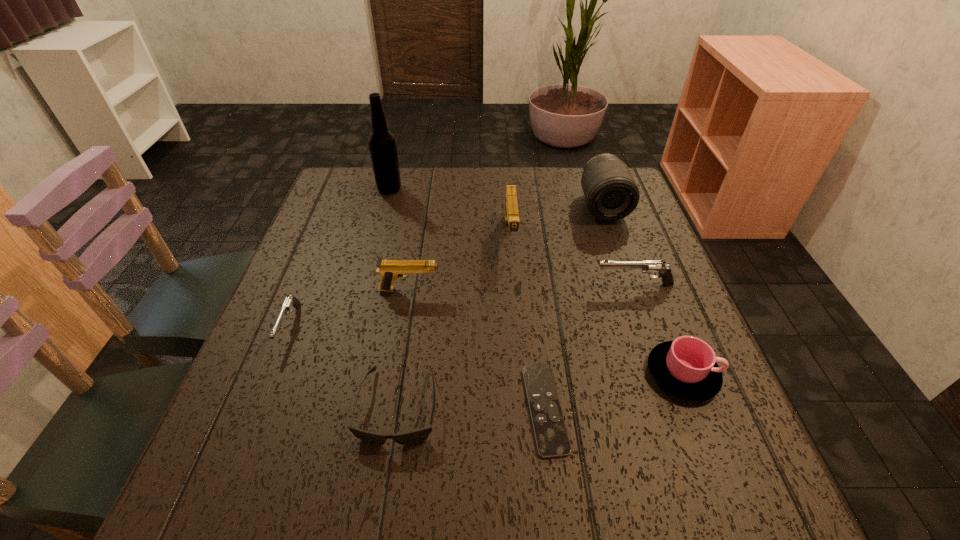
Where is `cup present at the right edge`? cup present at the right edge is located at coordinates (686, 367).

Where is `object present at the far left corner`? object present at the far left corner is located at coordinates (382, 145).

Find the location of `object present at the far right corner`. object present at the far right corner is located at coordinates (611, 193).

Locate an element on the screen. This screenshot has height=540, width=960. blank space at the far edge of the desktop is located at coordinates (388, 207).

Locate an element on the screen. This screenshot has height=540, width=960. vacant space at the near edge of the desktop is located at coordinates (460, 491).

At what (x,y) coordinates should I click in order to perform the action: click on free location at the left edge of the desktop. Please return your answer as a coordinate pair (x, y). The height and width of the screenshot is (540, 960). Looking at the image, I should click on (315, 291).

Find the location of a particular element. The width and height of the screenshot is (960, 540). vacant space at the right edge is located at coordinates (660, 338).

In the image, there is a desktop. At what (x,y) coordinates should I click in order to perform the action: click on free space at the far left corner. Please return your answer as a coordinate pair (x, y). The height and width of the screenshot is (540, 960). Looking at the image, I should click on (328, 204).

This screenshot has height=540, width=960. In the image, there is a desktop. In order to click on vacant space at the near left corner in this screenshot , I will do `click(218, 496)`.

Identify the location of free space between the bigger tan pistol and the shortest pistol. (400, 281).